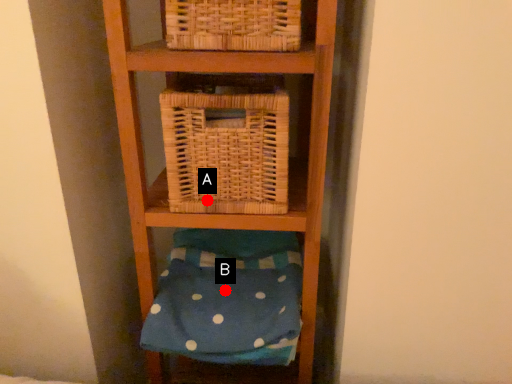
Question: Two points are circled on the image, labeled by A and B beside each circle. Which of the following is the farthest from the observer?

Choices:
 (A) A is further
 (B) B is further

Answer: (B)